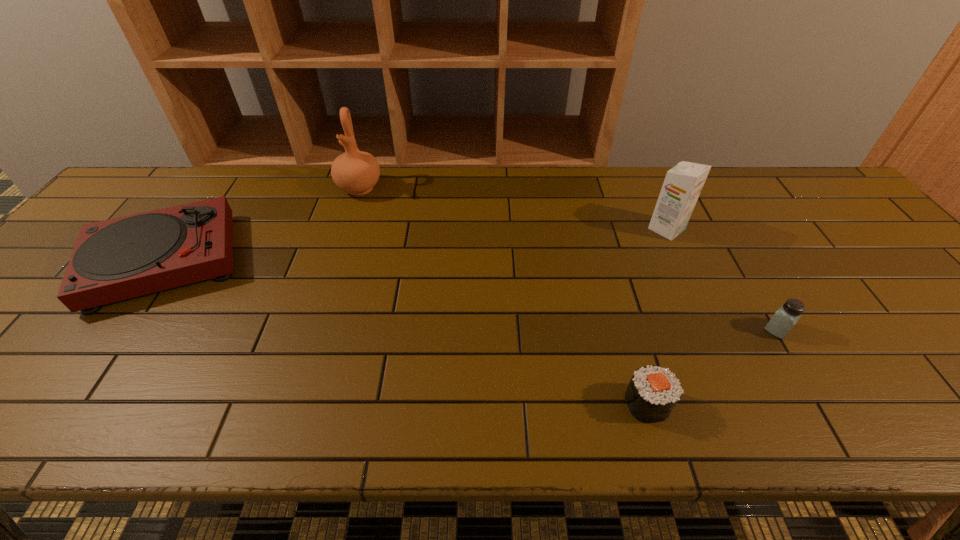
Identify the location of vacant region located 0.330m on the right of the carton. (803, 229).

The height and width of the screenshot is (540, 960). I want to click on free space located on the right of the record player, so click(x=314, y=260).

Locate an element on the screen. vacant area situated 0.130m on the front of the saltshaker is located at coordinates (814, 393).

Identify the location of free space located 0.140m on the left of the third object from left to right. The width and height of the screenshot is (960, 540). (553, 404).

You are a GUI agent. You are given a task and a screenshot of the screen. Output one action in this format:
    pyautogui.click(x=<x>, y=<y>)
    Task: Click on the object that is positioned at the far edge
    
    Given the screenshot: What is the action you would take?
    [356, 172]

This screenshot has width=960, height=540. I want to click on object present at the near edge, so (x=653, y=392).

Where is `object that is at the left edge`? This screenshot has width=960, height=540. object that is at the left edge is located at coordinates (121, 258).

Find the location of a particular element. free space at the far edge is located at coordinates (284, 193).

Where is `vacant space at the near edge`? The width and height of the screenshot is (960, 540). vacant space at the near edge is located at coordinates (494, 422).

In the image, there is a desktop. Identify the location of free space at the left edge. The image size is (960, 540). (36, 364).